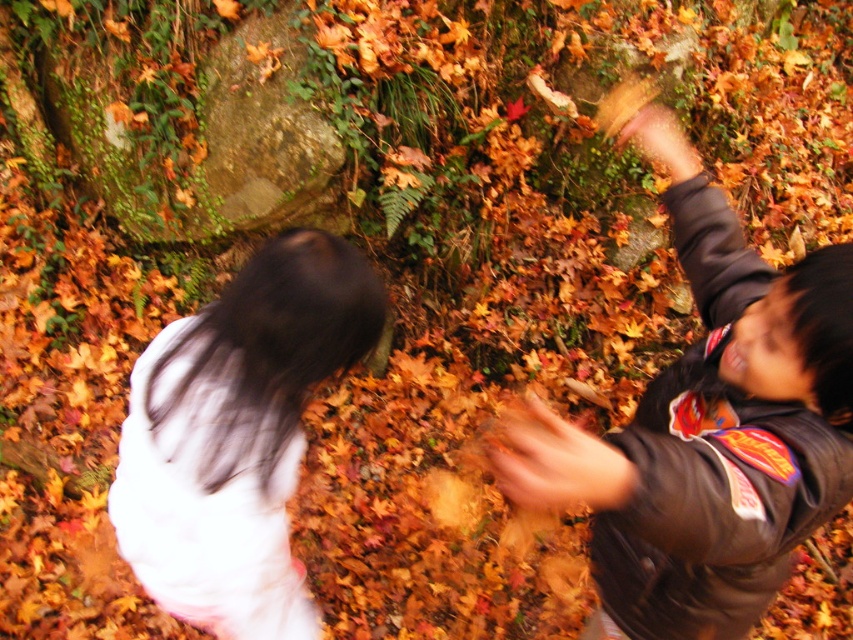
Does point (795, 339) come behind point (529, 417)?

Yes, it is.

Does dark gray jacket at right have a smaller size compared to blurred brown hand at center?

No, dark gray jacket at right is not smaller than blurred brown hand at center.

Between point (703, 444) and point (575, 477), which one is positioned in front?

Positioned in front is point (575, 477).

The image size is (853, 640). I want to click on dark gray jacket at right, so click(x=706, y=429).

Is point (834, 394) positioned after point (120, 529)?

No.

Between point (637, 132) and point (259, 260), which one is positioned behind?

The point (637, 132) is more distant.

Identify the location of dark gray jacket at right. The height and width of the screenshot is (640, 853). (706, 429).

Who is shorter, white matte shirt at upper left or blurred brown hand at center?

blurred brown hand at center is shorter.

Can you confirm if white matte shirt at upper left is wider than blurred brown hand at center?

Yes.

Which is behind, point (380, 280) or point (540, 467)?

The point (380, 280) is behind.

Identify the location of white matte shirt at upper left. (236, 435).